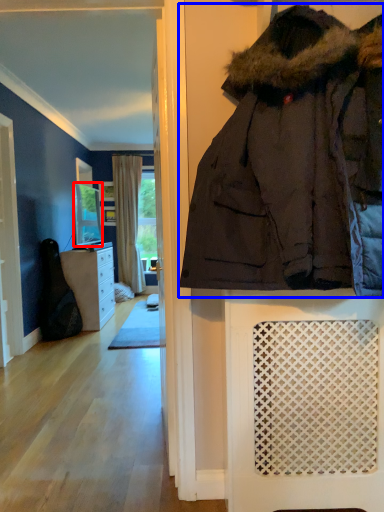
Question: Which of the following is the closest to the observer, mirror (highlighted by a red box) or jacket (highlighted by a blue box)?

Choices:
 (A) mirror
 (B) jacket

Answer: (B)